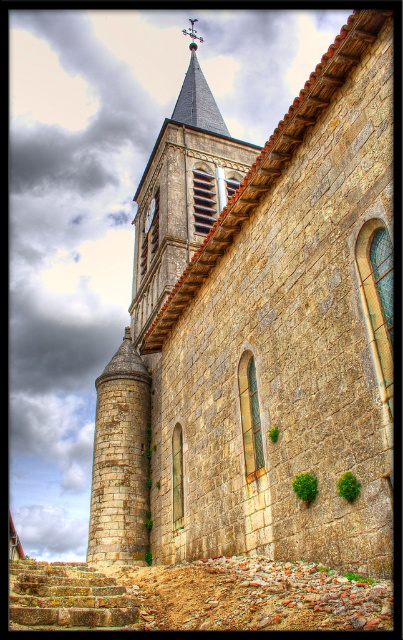
Is stone textured stairs at lower left closer to the viewer compared to smooth gray steeple at upper center?

That is True.

Is stone textured stairs at lower left to the left of smooth gray steeple at upper center from the viewer's perspective?

Correct, you'll find stone textured stairs at lower left to the left of smooth gray steeple at upper center.

Is point (16, 596) positioned before point (203, 115)?

Yes, it is.

Where is `stone textured stairs at lower left`? This screenshot has height=640, width=403. stone textured stairs at lower left is located at coordinates (66, 596).

Can you confirm if smooth gray steeple at upper center is taller than brass clock face at center?

Indeed, smooth gray steeple at upper center has a greater height compared to brass clock face at center.

Is smooth gray steeple at upper center wider than brass clock face at center?

Yes.

Identify the location of smooth gray steeple at upper center. pos(197,96).

Between point (365, 300) and point (72, 605), which one is positioned behind?

Point (72, 605)

Who is positioned more to the right, stone church at center or stone textured stairs at lower left?

stone church at center is more to the right.

Which is behind, point (280, 364) or point (72, 600)?

The point (280, 364) is behind.

Where is `stone church at center`? The width and height of the screenshot is (403, 640). stone church at center is located at coordinates (259, 333).